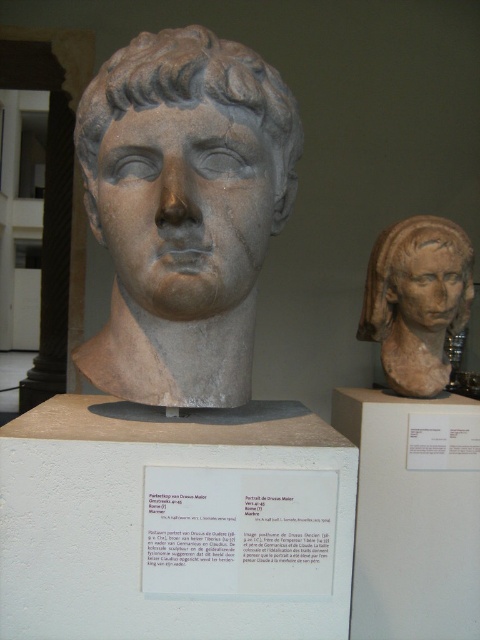
You are an art conservator assessing the structural stability of the two heads in the museum display. Given that the gray stone head at center is made of marble and the brown clay head at upper right is terracotta, which head might require more support due to its size and material properties? Explain your reasoning.

The brown clay head at upper right requires more support because it is wider than the gray stone head at center. Terracotta, being less dense and more fragile than marble, combined with its larger width, may necessitate additional structural support to prevent damage or instability.

You are a museum curator who needs to install a motion sensor in the room. The sensor must be placed exactly halfway between the two points marked as point (x=292, y=148) and another point. Where should you place the sensor?

The sensor should be placed at the midpoint between the two points, which is (x=292, y=148) plus half the distance of 1.07 meters. However, since only one point is provided in the objects, the exact coordinates cannot be determined without knowing the second point.

You are a museum visitor standing in front of the two busts. You want to take a photo of both the matte stone bust at right and the brown clay head at upper right. Which one will appear larger in the photo?

The matte stone bust at right will appear larger in the photo because it is closer to the viewer than the brown clay head at upper right.